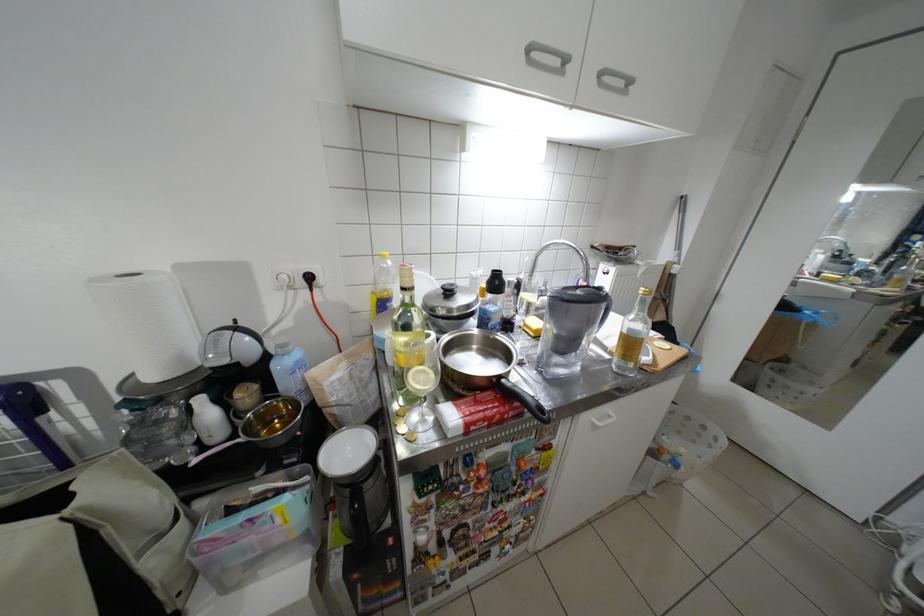
Find where to lift the pot lid handle. Please return your answer as a coordinate pair (x, y).

(448, 290)